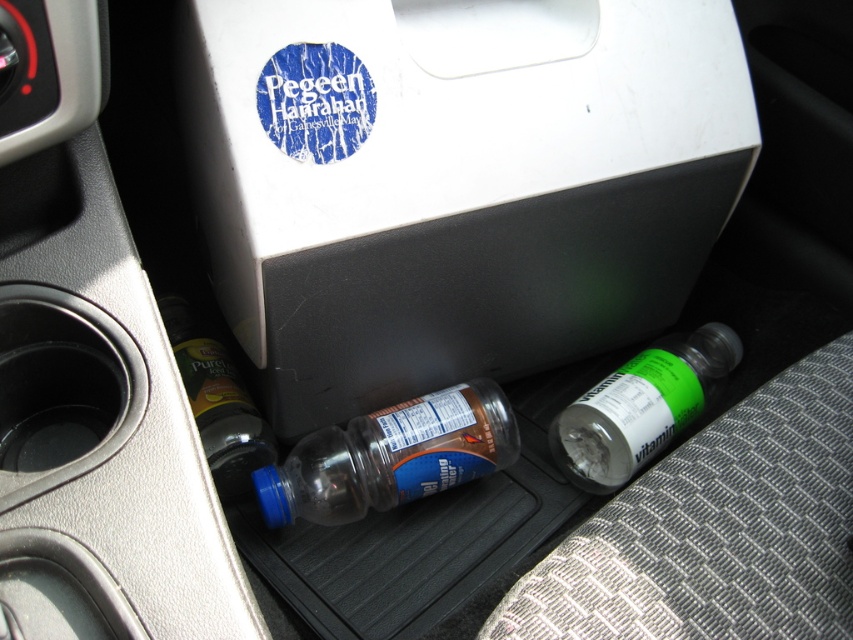
What object is located at the coordinates point (456, 182) in the vehicle interior?

The white matte box at center is located at point (456, 182).

Please provide the 2D coordinates of the green translucent bottle at lower right in the vehicle interior image.

The 2D coordinates of the green translucent bottle at lower right are at point (641, 406).